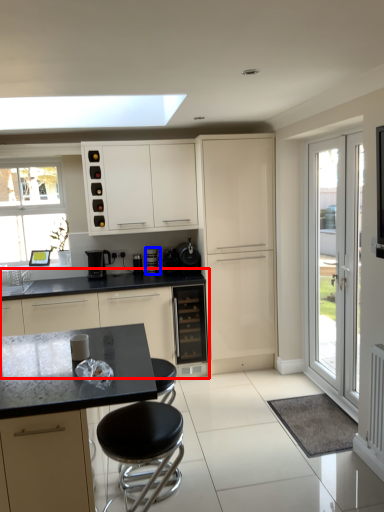
Question: Which object is closer to the camera taking this photo, cabinetry (highlighted by a red box) or coffee machine (highlighted by a blue box)?

Choices:
 (A) cabinetry
 (B) coffee machine

Answer: (A)